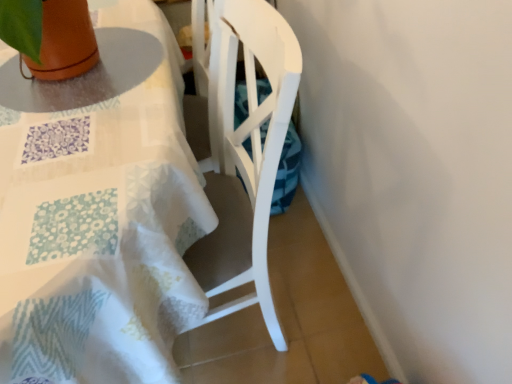
The image size is (512, 384). I want to click on white fabric-covered table at upper left, so click(99, 212).

The image size is (512, 384). Describe the element at coordinates (99, 212) in the screenshot. I see `white fabric-covered table at upper left` at that location.

Measure the distance between point (68,165) and camera.

Point (68,165) and camera are 27.95 inches apart from each other.

What are the coordinates of `white fabric-covered table at upper left` in the screenshot? It's located at (99, 212).